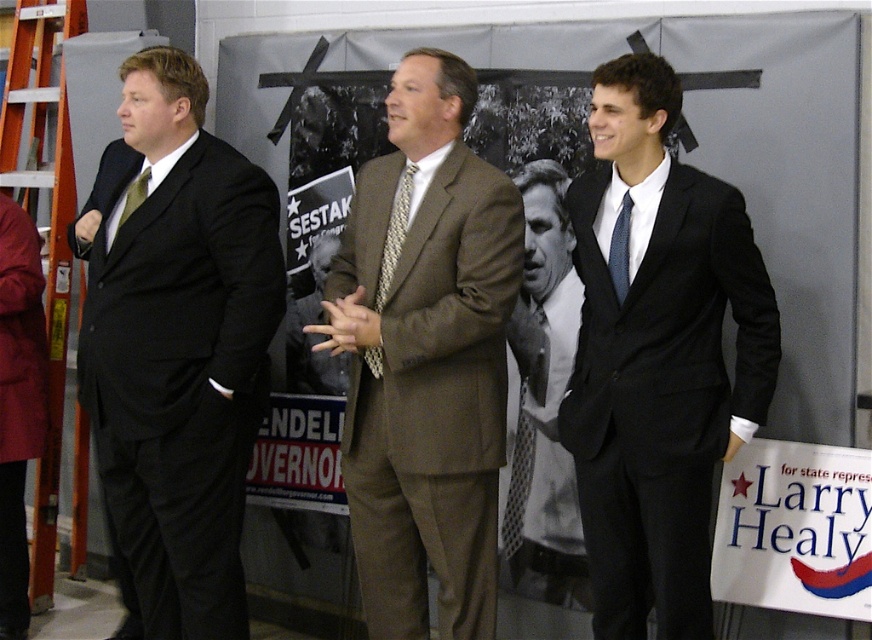
You are a photographer at the event. You need to position a spotlight exactly at the point marked by the coordinates point (545, 403). What will the spotlight illuminate?

The spotlight will illuminate the white shirt with checkered tie at center, as the point (545, 403) marks that location.

You are a photographer at the event and need to capture a clear photo of the white paper sign at lower right. However, the orange plastic ladder at left is blocking your view. Can you move the ladder to the side to get an unobstructed shot?

The white paper sign at lower right is positioned under the orange plastic ladder at left, so moving the ladder to the side would allow you to see the sign clearly.